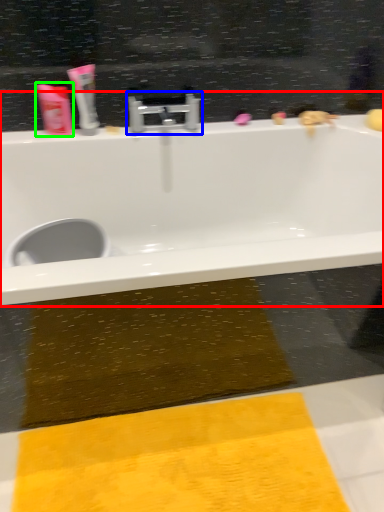
Question: Based on their relative distances, which object is nearer to bathtub (highlighted by a red box)? Choose from tap (highlighted by a blue box) and toiletry (highlighted by a green box).

Choices:
 (A) tap
 (B) toiletry

Answer: (A)